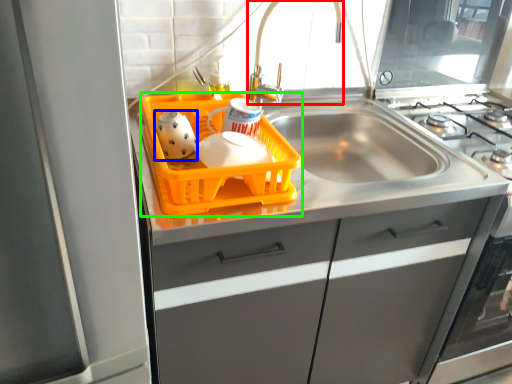
Question: Estimate the real-world distances between objects in this image. Which object is closer to faucet (highlighted by a red box), tea pot (highlighted by a blue box) or basket (highlighted by a green box)?

Choices:
 (A) tea pot
 (B) basket

Answer: (B)